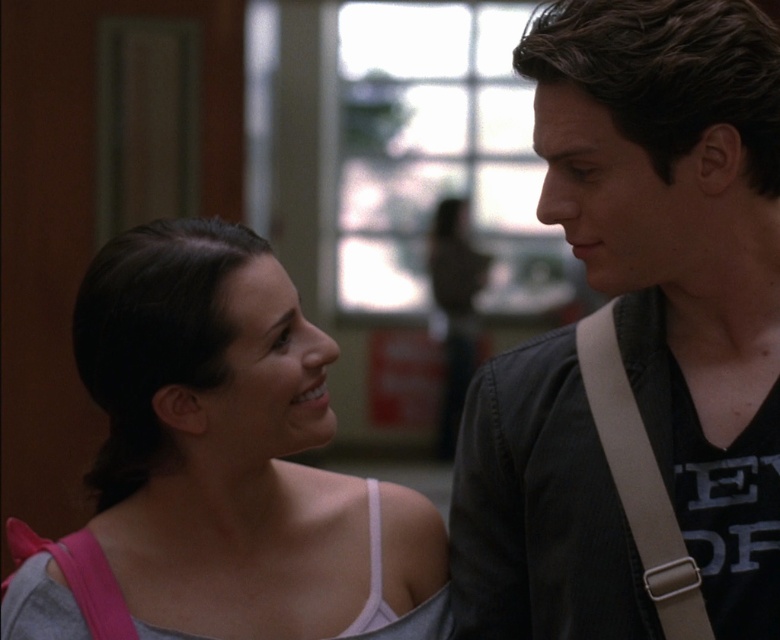
Question: Which of the following is the farthest from the observer?

Choices:
 (A) dark brown hair at upper right
 (B) matte gray tank top at center

Answer: (B)

Question: Which object is the closest to the dark brown hair at upper right?

Choices:
 (A) matte gray tank top at center
 (B) tan fabric strap at right

Answer: (B)

Question: Can you confirm if matte gray tank top at center is bigger than tan fabric strap at right?

Choices:
 (A) yes
 (B) no

Answer: (A)

Question: In this image, where is dark brown hair at upper right located relative to tan fabric strap at right?

Choices:
 (A) left
 (B) right

Answer: (A)

Question: Does dark brown hair at upper right have a larger size compared to tan fabric strap at right?

Choices:
 (A) no
 (B) yes

Answer: (B)

Question: Considering the real-world distances, which object is closest to the matte gray tank top at center?

Choices:
 (A) dark brown hair at upper right
 (B) tan fabric strap at right

Answer: (A)